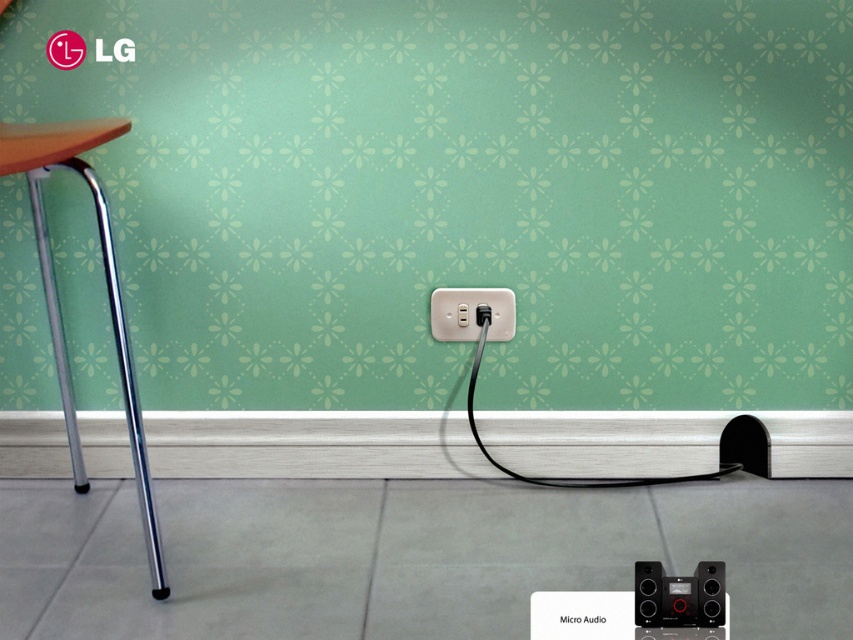
You are trying to place a rectangular rug that is 0.2 units wide in this room. The rug must be placed such that it does not cover any part of the silver chair leg at left. Given the chair leg is located at point (106, 284), what is the minimum distance in units you should keep between the edge of the rug and the chair leg to ensure it doesn,t overlap?

The minimum distance required between the edge of the rug and the silver chair leg at left is 0.1 units. This ensures the rug does not overlap with the chair leg, as the rug is 0.2 units wide and the chair leg is positioned at (106, 284).